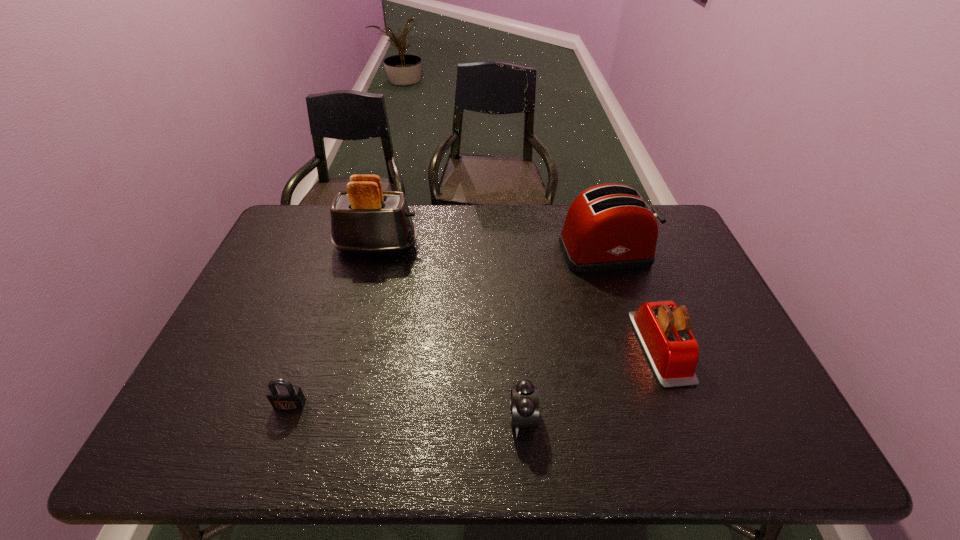
This screenshot has width=960, height=540. I want to click on the leftmost toaster, so click(x=364, y=219).

I want to click on the second shortest toaster, so click(x=609, y=227).

You are a GUI agent. You are given a task and a screenshot of the screen. Output one action in this format:
    pyautogui.click(x=<x>, y=<y>)
    Task: Click on the nearest toaster
    The height and width of the screenshot is (540, 960).
    Given the screenshot: What is the action you would take?
    pyautogui.click(x=663, y=329)

Locate an element on the screen. This screenshot has height=540, width=960. the shortest toaster is located at coordinates (663, 329).

This screenshot has height=540, width=960. What are the coordinates of `the third object from right to left` in the screenshot? It's located at (524, 405).

Identify the location of padlock. (282, 395).

This screenshot has height=540, width=960. I want to click on vacant position located on the side of the leftmost toaster with the control lever, so click(516, 246).

Identify the location of vacant space located on the left of the second tallest object. (539, 253).

This screenshot has width=960, height=540. Identify the location of vacant space located on the back of the third shortest object. (628, 260).

Locate an element on the screen. The height and width of the screenshot is (540, 960). free location located on the front side of the third object from left to right is located at coordinates (447, 418).